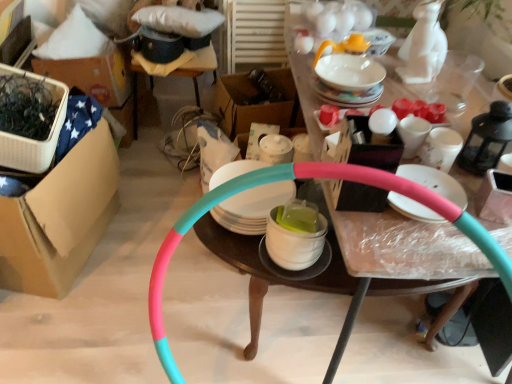
The image size is (512, 384). What are the coordinates of `vacant space situated above matte white plate at center, which ranks as the third tableware in bottom-to-top order (from a real-world perspective)` in the screenshot? It's located at (435, 186).